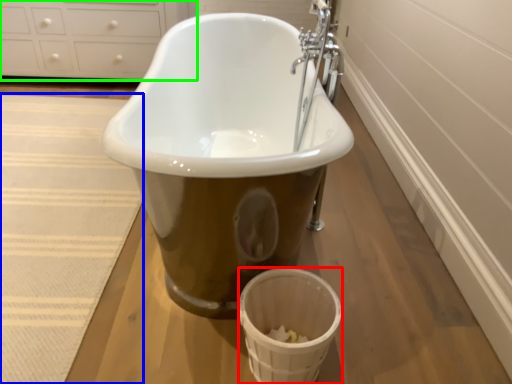
Question: Considering the real-world distances, which object is farthest from basket (highlighted by a red box)? bath mat (highlighted by a blue box) or cabinetry (highlighted by a green box)?

Choices:
 (A) bath mat
 (B) cabinetry

Answer: (B)